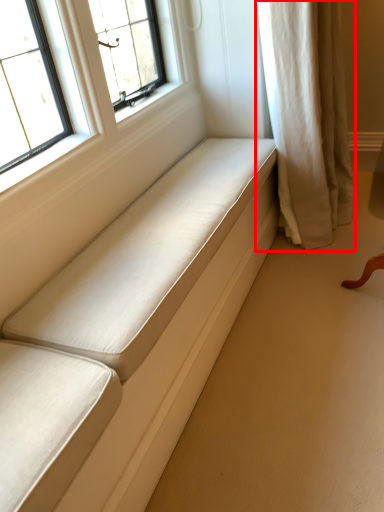
Question: From the image, what is the correct spatial relationship of curtain (annotated by the red box) in relation to furniture?

Choices:
 (A) left
 (B) right

Answer: (B)